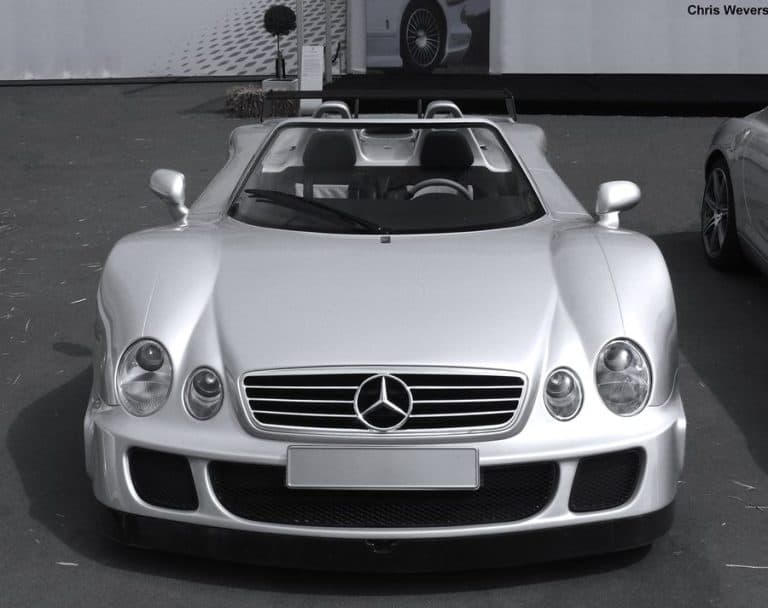
At what (x,y) coordinates should I click in order to perform the action: click on 2 mirrors shown. Please return your answer as a coordinate pair (x, y). Looking at the image, I should click on (608, 179), (167, 171).